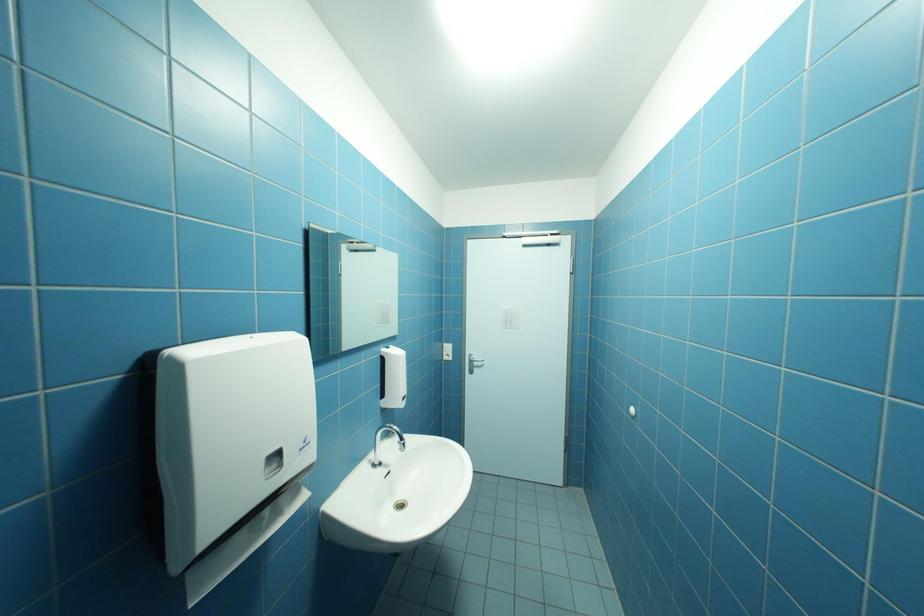
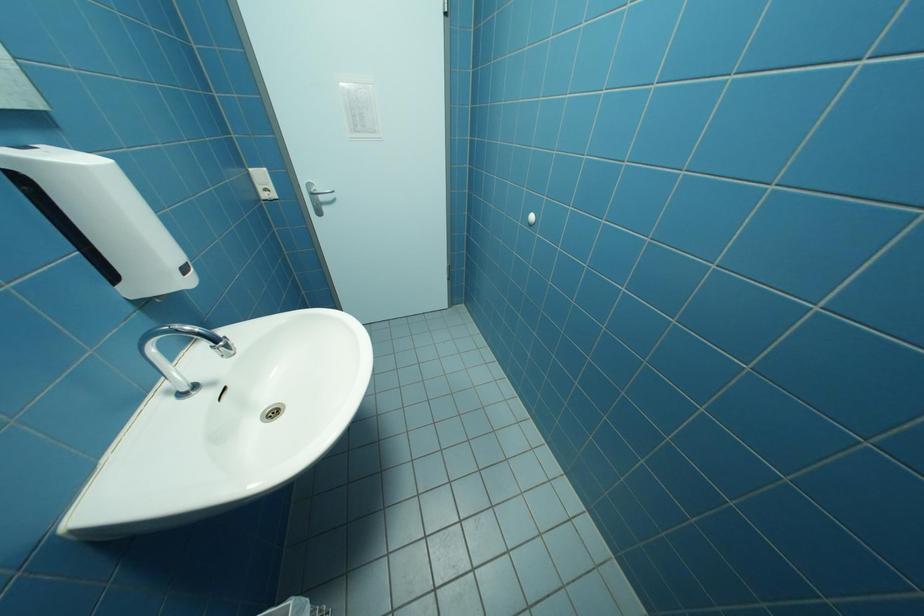
Based on the continuous images, in which direction is the camera rotating?

The rotation direction of the camera is right-down.